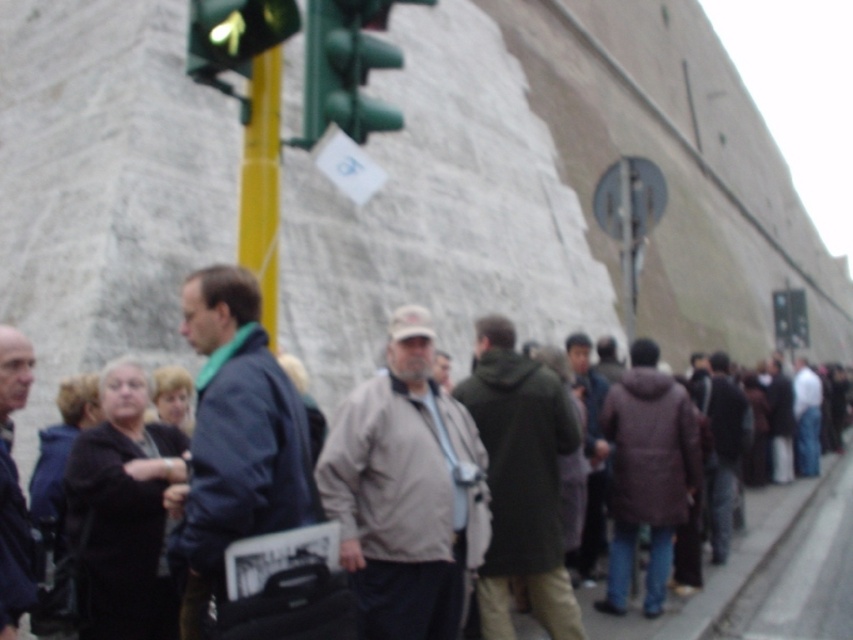
Between light brown fabric jacket at center and green glass traffic light at upper left, which one is positioned lower?

light brown fabric jacket at center

Between light brown fabric jacket at center and green glass traffic light at upper left, which one has more height?

Standing taller between the two is green glass traffic light at upper left.

Locate an element on the screen. light brown fabric jacket at center is located at coordinates (401, 490).

The image size is (853, 640). I want to click on light brown fabric jacket at center, so click(x=401, y=490).

Where is `green matte traffic light at upper center`? The height and width of the screenshot is (640, 853). green matte traffic light at upper center is located at coordinates (346, 67).

Measure the distance between green matte traffic light at upper center and dark blue jacket at left.

green matte traffic light at upper center and dark blue jacket at left are 10.48 meters apart.

Is point (367, 131) positioned after point (28, 589)?

Yes, it is behind point (28, 589).

Identify the location of green matte traffic light at upper center. (346, 67).

Is dark blue jacket at center taller than green glass traffic light at upper left?

In fact, dark blue jacket at center may be shorter than green glass traffic light at upper left.

The height and width of the screenshot is (640, 853). Find the location of `dark blue jacket at center`. dark blue jacket at center is located at coordinates (234, 440).

Between point (229, 417) and point (248, 16), which one is positioned in front?

Point (248, 16) is more forward.

Identify the location of dark blue jacket at center. (234, 440).